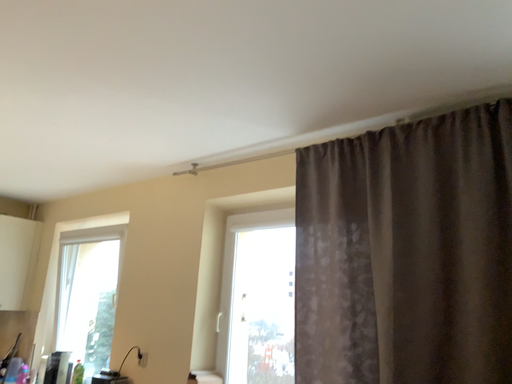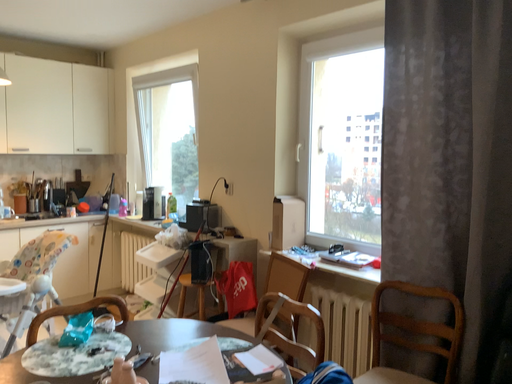
Question: Which way did the camera rotate in the video?

Choices:
 (A) rotated left
 (B) rotated right

Answer: (A)